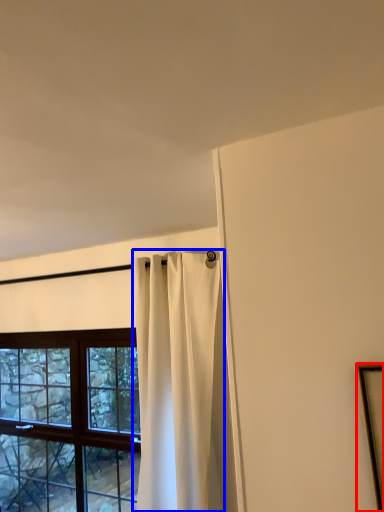
Question: Among these objects, which one is nearest to the camera, picture frame (highlighted by a red box) or curtain (highlighted by a blue box)?

Choices:
 (A) picture frame
 (B) curtain

Answer: (A)